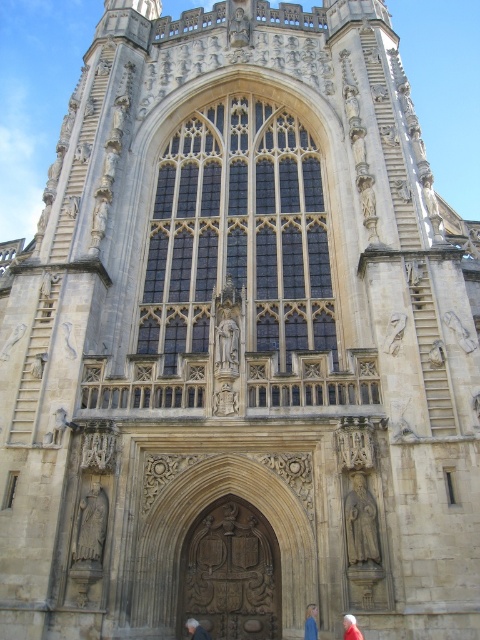
You are an architect planning to install a new door handle on the carved stone door at center and the blonde hair at lower center. Considering their sizes, which object would require a larger door handle?

The carved stone door at center is much taller than the blonde hair at lower center, so it would require a larger door handle.

You are an art student analyzing the sculptures on the cathedral facade. You notice two elements of interest. The first is the blonde hair at lower center, and the second is the red fabric person at lower right. Based on their sizes, which of these two elements is more likely to be part of a central figure or focal point in the sculptural relief?

The red fabric person at lower right is more likely to be the central figure or focal point since it is thicker than the blonde hair at lower center, indicating greater prominence.